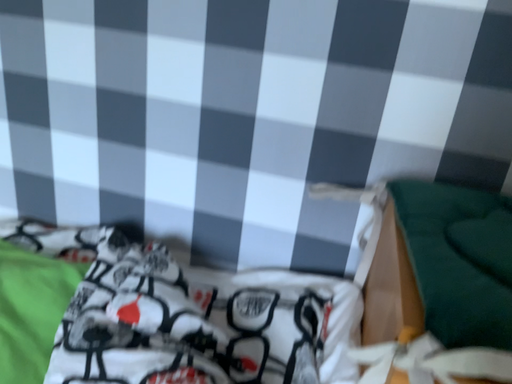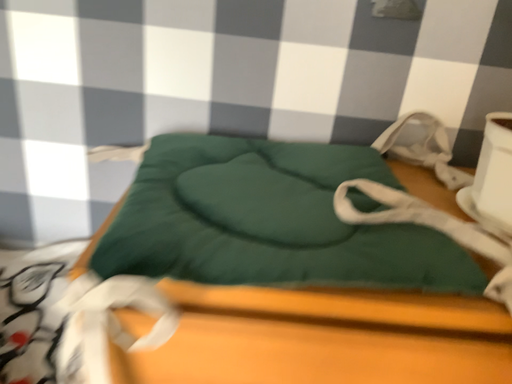
Question: Which way did the camera rotate in the video?

Choices:
 (A) rotated left
 (B) rotated right

Answer: (B)